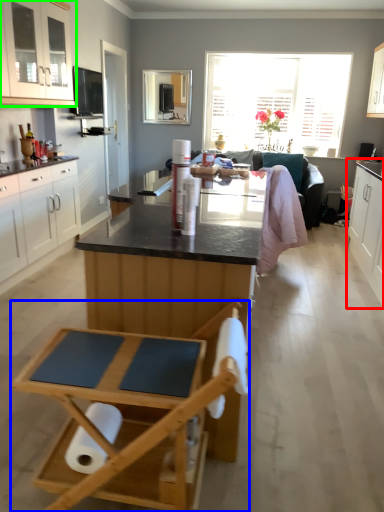
Question: Based on their relative distances, which object is farther from cabinetry (highlighted by a red box)? Choose from folding chair (highlighted by a blue box) and cabinetry (highlighted by a green box).

Choices:
 (A) folding chair
 (B) cabinetry

Answer: (B)